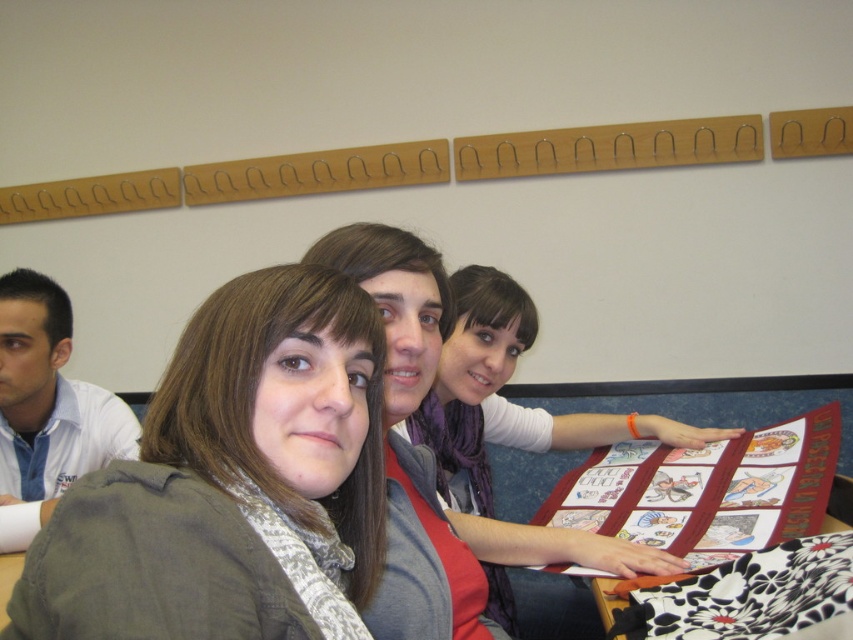
Between red fabric quilt at center and matte gray scarf at left, which one appears on the left side from the viewer's perspective?

matte gray scarf at left

Based on the photo, which is below, red fabric quilt at center or matte gray scarf at left?

red fabric quilt at center is below.

Is point (561, 570) closer to camera compared to point (20, 440)?

Yes, it is.

Locate an element on the screen. The width and height of the screenshot is (853, 640). red fabric quilt at center is located at coordinates (705, 490).

Is matte gray jacket at center thinner than matte red book at center?

Correct, matte gray jacket at center's width is less than matte red book at center's.

Can you confirm if matte gray jacket at center is positioned to the right of matte red book at center?

In fact, matte gray jacket at center is to the left of matte red book at center.

The width and height of the screenshot is (853, 640). What do you see at coordinates (231, 481) in the screenshot? I see `matte gray jacket at center` at bounding box center [231, 481].

This screenshot has width=853, height=640. I want to click on matte gray jacket at center, so click(231, 481).

Which is in front, point (271, 330) or point (105, 435)?

Point (271, 330) is more forward.

Identify the location of matte gray jacket at center. (231, 481).

Identify the location of matte gray jacket at center. This screenshot has width=853, height=640. (231, 481).